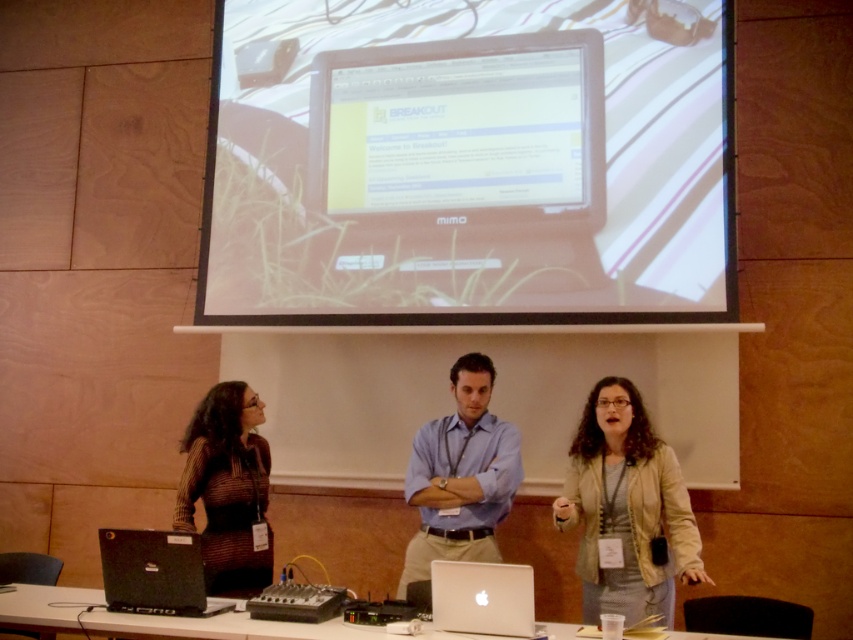
Between white glossy screen at upper center and white glossy table at lower center, which one is positioned lower?

Positioned lower is white glossy table at lower center.

Does white glossy screen at upper center come in front of white glossy table at lower center?

No, it is not.

The image size is (853, 640). Find the location of `white glossy screen at upper center`. white glossy screen at upper center is located at coordinates (454, 131).

Can you confirm if light beige jacket at center is wider than blue shirt at center?

Correct, the width of light beige jacket at center exceeds that of blue shirt at center.

Is point (624, 440) more distant than point (495, 556)?

No, (624, 440) is closer to viewer.

Who is more distant from viewer, [587,396] or [485,416]?

The point [587,396] is more distant.

Locate an element on the screen. This screenshot has height=640, width=853. light beige jacket at center is located at coordinates (627, 508).

Between white glossy screen at upper center and black plastic mixer at center, which one is positioned higher?

white glossy screen at upper center is above.

Does white glossy screen at upper center have a greater width compared to black plastic mixer at center?

Indeed, white glossy screen at upper center has a greater width compared to black plastic mixer at center.

Is point (448, 189) closer to viewer compared to point (289, 582)?

No, it is behind (289, 582).

Where is `white glossy screen at upper center`? white glossy screen at upper center is located at coordinates (454, 131).